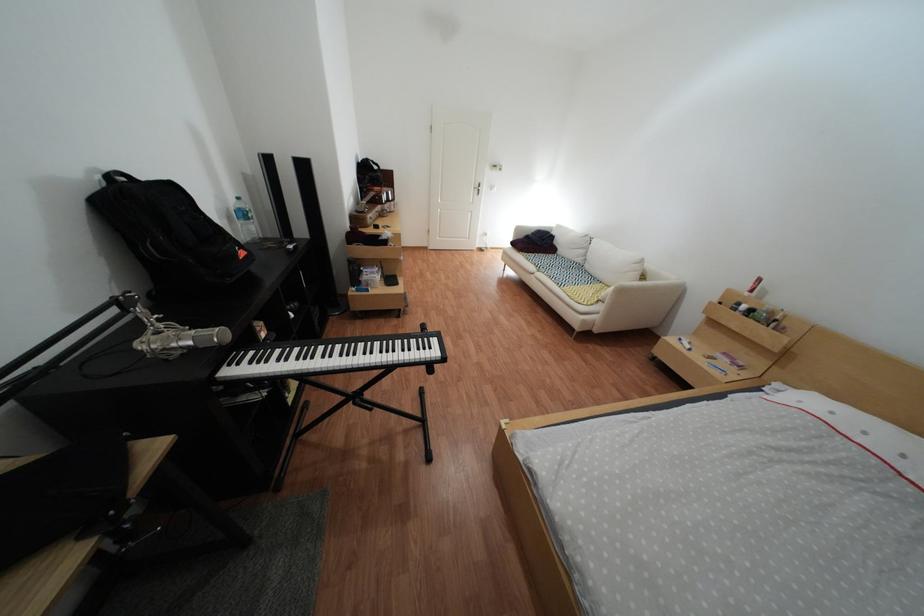
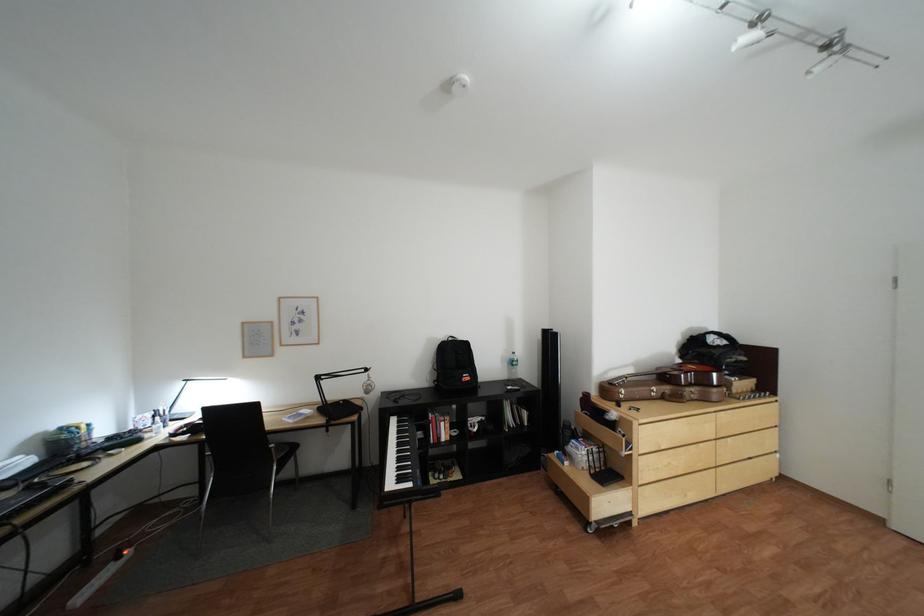
Locate, in the second image, the point that corresponds to (x=402, y=207) in the first image.

(703, 391)